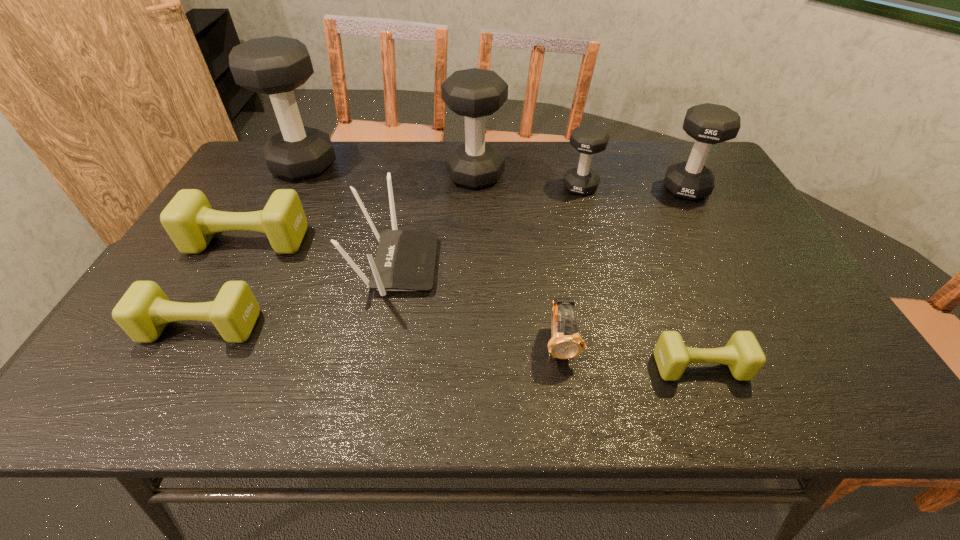
The height and width of the screenshot is (540, 960). Find the location of `free space between the watch and the sixth tallest dumbbell`. free space between the watch and the sixth tallest dumbbell is located at coordinates (381, 335).

Where is `vacant area between the tallest object and the fourth shortest dumbbell`? vacant area between the tallest object and the fourth shortest dumbbell is located at coordinates (443, 176).

I want to click on free space between the second shortest dumbbell and the smallest olive dumbbell, so click(x=451, y=347).

Choose which object is the seventh nearest neighbor to the second nearest dumbbell. Please provide its 2D coordinates. Your answer should be formatted as a tuple, i.e. [(x, y)], where the tuple contains the x and y coordinates of a point satisfying the conditions above.

[(588, 139)]

Identify the location of object that is the fifth closest to the smallest gray dumbbell. (743, 355).

You are a GUI agent. You are given a task and a screenshot of the screen. Output one action in this format:
    pyautogui.click(x=<x>, y=<y>)
    Task: Click on the dumbbell that is the third closest to the second biggest gray dumbbell
    
    Given the screenshot: What is the action you would take?
    pyautogui.click(x=189, y=220)

Identify the location of the third closest dumbbell to the sixth object from left to right. The width and height of the screenshot is (960, 540). 474,93.

Locate which gray dumbbell ranks second in proximity to the watch. Please provide its 2D coordinates. Your answer should be formatted as a tuple, i.e. [(x, y)], where the tuple contains the x and y coordinates of a point satisfying the conditions above.

[(474, 93)]

Point out which gray dumbbell is positioned as the fourth nearest to the smallest olive dumbbell. Please provide its 2D coordinates. Your answer should be formatted as a tuple, i.e. [(x, y)], where the tuple contains the x and y coordinates of a point satisfying the conditions above.

[(276, 65)]

I want to click on olive dumbbell that is the second closest one to the shortest object, so [x=189, y=220].